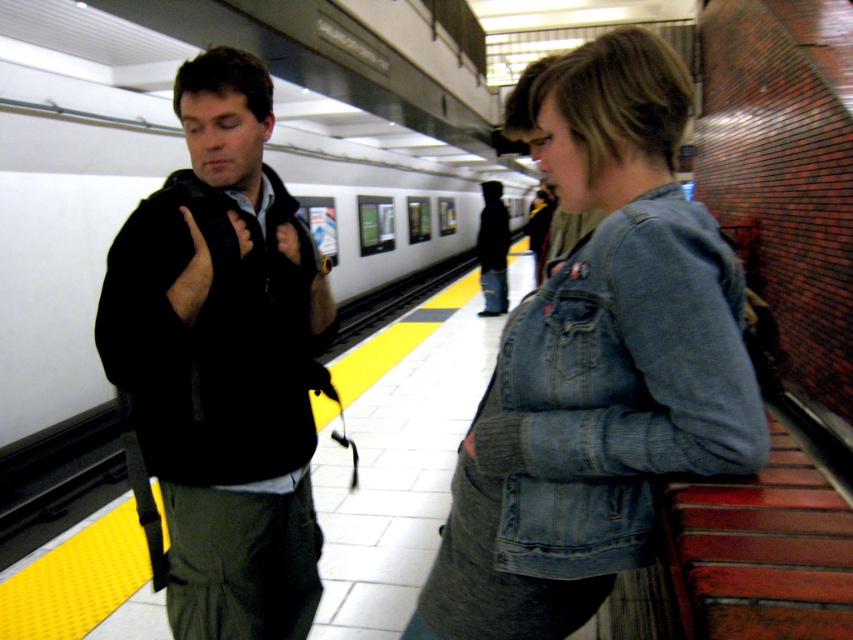
Question: Considering the relative positions of black softshell jacket at left and faded denim jacket at lower right in the image provided, where is black softshell jacket at left located with respect to faded denim jacket at lower right?

Choices:
 (A) below
 (B) above

Answer: (A)

Question: Is black softshell jacket at left smaller than faded denim jacket at lower right?

Choices:
 (A) yes
 (B) no

Answer: (B)

Question: Does black softshell jacket at left have a smaller size compared to faded denim jacket at lower right?

Choices:
 (A) yes
 (B) no

Answer: (B)

Question: Which object is closer to the camera taking this photo?

Choices:
 (A) black softshell jacket at left
 (B) faded denim jacket at lower right

Answer: (B)

Question: Which point appears closest to the camera in this image?

Choices:
 (A) (311, 520)
 (B) (596, 275)

Answer: (B)